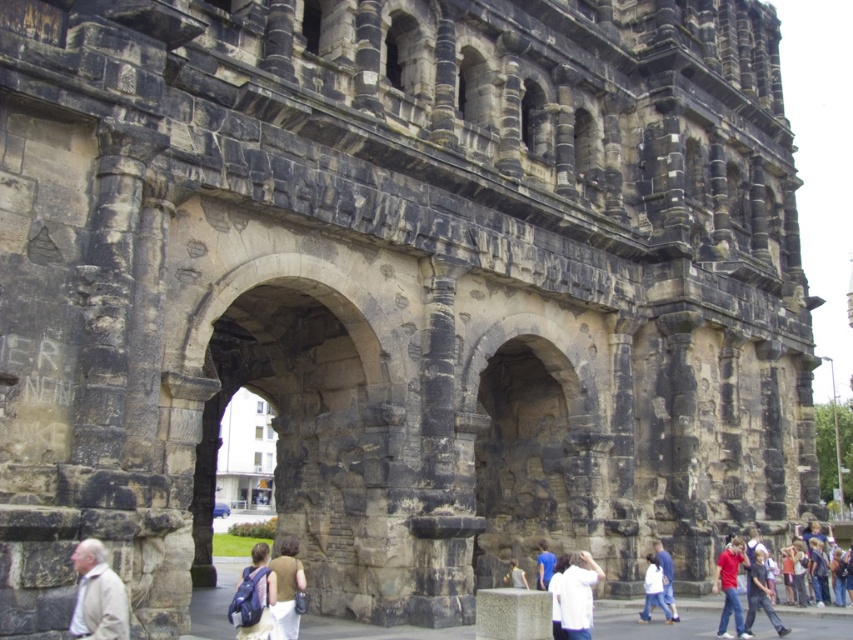
Question: Among these objects, which one is nearest to the camera?

Choices:
 (A) white fabric at center
 (B) white cotton shirt at lower right
 (C) blue backpack at lower center
 (D) light beige jacket at lower left

Answer: (D)

Question: Does light beige jacket at lower left come behind red shirt at lower right?

Choices:
 (A) no
 (B) yes

Answer: (A)

Question: Can you confirm if dark gray stone archway at center is positioned to the left of white cotton shirt at lower right?

Choices:
 (A) yes
 (B) no

Answer: (A)

Question: Which point is closer to the camera?

Choices:
 (A) (560, 611)
 (B) (538, 541)
 (C) (279, 605)
 (D) (582, 554)

Answer: (C)

Question: Which of the following is the farthest from the observer?

Choices:
 (A) (564, 627)
 (B) (749, 598)

Answer: (B)

Question: Is blue backpack at lower center below blue fabric shirt at center?

Choices:
 (A) no
 (B) yes

Answer: (B)